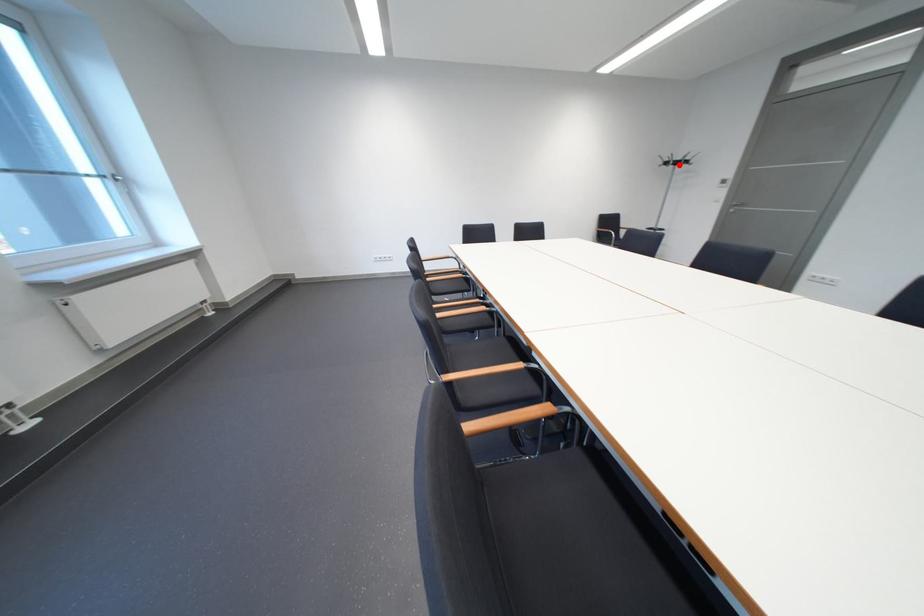
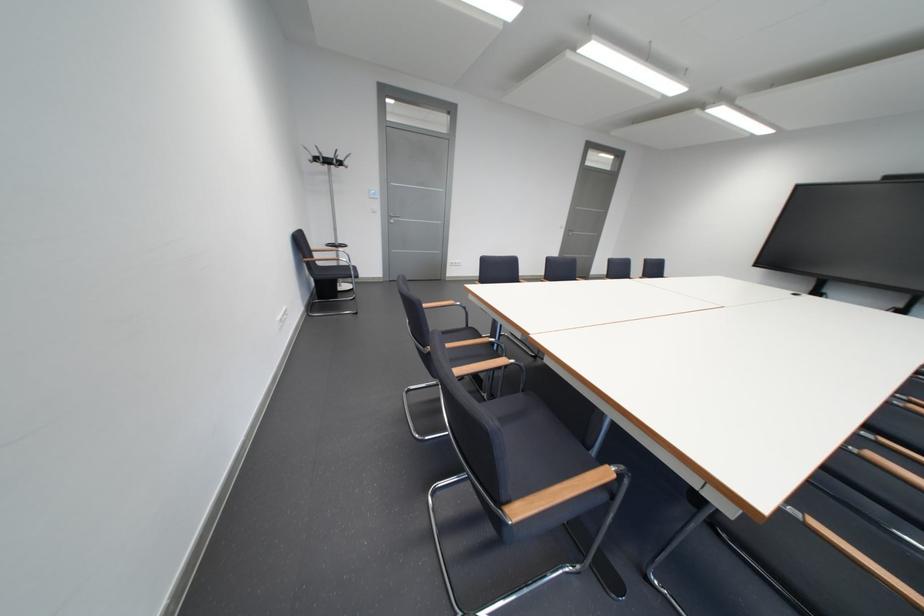
The point at the highlighted location is marked in the first image. Where is the corresponding point in the second image?

(330, 161)